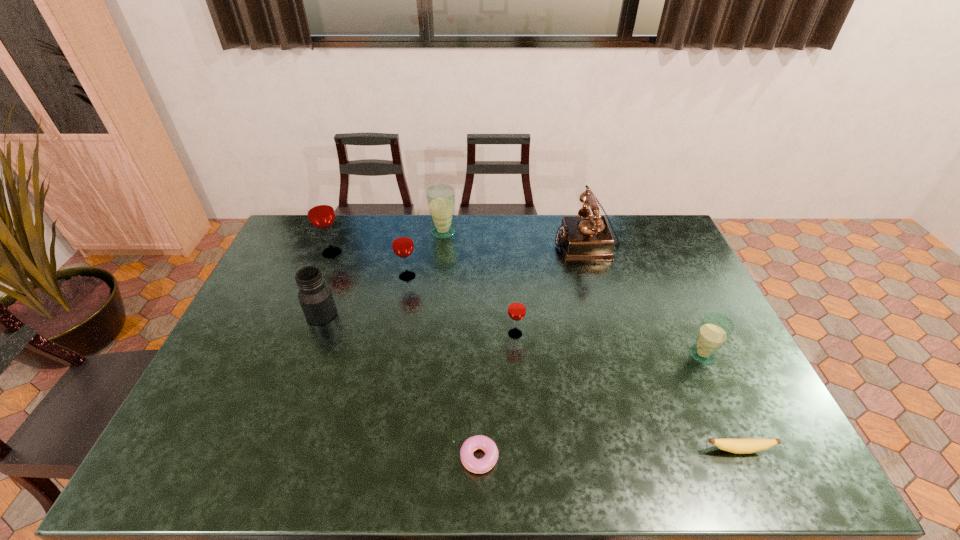
This screenshot has width=960, height=540. Identify the location of free spot between the doughnut and the right blue glass. (588, 407).

Where is `the fifth closest object to the doughnut`? Image resolution: width=960 pixels, height=540 pixels. the fifth closest object to the doughnut is located at coordinates (715, 329).

Identify which object is located as the fifth nearest to the biggest red glass. Please provide its 2D coordinates. Your answer should be formatted as a tuple, i.e. [(x, y)], where the tuple contains the x and y coordinates of a point satisfying the conditions above.

[(584, 238)]

Choose which glass is the fourth nearest neighbor to the leftmost red glass. Please provide its 2D coordinates. Your answer should be formatted as a tuple, i.e. [(x, y)], where the tuple contains the x and y coordinates of a point satisfying the conditions above.

[(715, 329)]

Locate which glass ranks in proximity to the second shortest object. Please provide its 2D coordinates. Your answer should be formatted as a tuple, i.e. [(x, y)], where the tuple contains the x and y coordinates of a point satisfying the conditions above.

[(715, 329)]

You are a GUI agent. You are given a task and a screenshot of the screen. Output one action in this format:
    pyautogui.click(x=<x>, y=<y>)
    Task: Click on the red glass that is the second closest one to the nearest glass
    
    Given the screenshot: What is the action you would take?
    pyautogui.click(x=402, y=242)

In order to click on the second closest red glass to the nearer blue glass in this screenshot , I will do `click(402, 242)`.

Find the location of `vacant position in the image that satisfies the following two spatial constraints: 1. on the dial of the telephone; 2. on the front side of the fifth nearest object`. vacant position in the image that satisfies the following two spatial constraints: 1. on the dial of the telephone; 2. on the front side of the fifth nearest object is located at coordinates (607, 314).

You are a GUI agent. You are given a task and a screenshot of the screen. Output one action in this format:
    pyautogui.click(x=<x>, y=<y>)
    Task: Click on the free location that satisfies the following two spatial constraints: 1. on the back side of the fifth nearest object; 2. on the left side of the second nearest red glass
    
    Given the screenshot: What is the action you would take?
    pyautogui.click(x=335, y=276)

You are a GUI agent. You are given a task and a screenshot of the screen. Output one action in this format:
    pyautogui.click(x=<x>, y=<y>)
    Task: Click on the vacant space that satisfies the following two spatial constraints: 1. on the dial of the telephone; 2. on the right side of the eighth tallest object
    
    Given the screenshot: What is the action you would take?
    pyautogui.click(x=647, y=450)